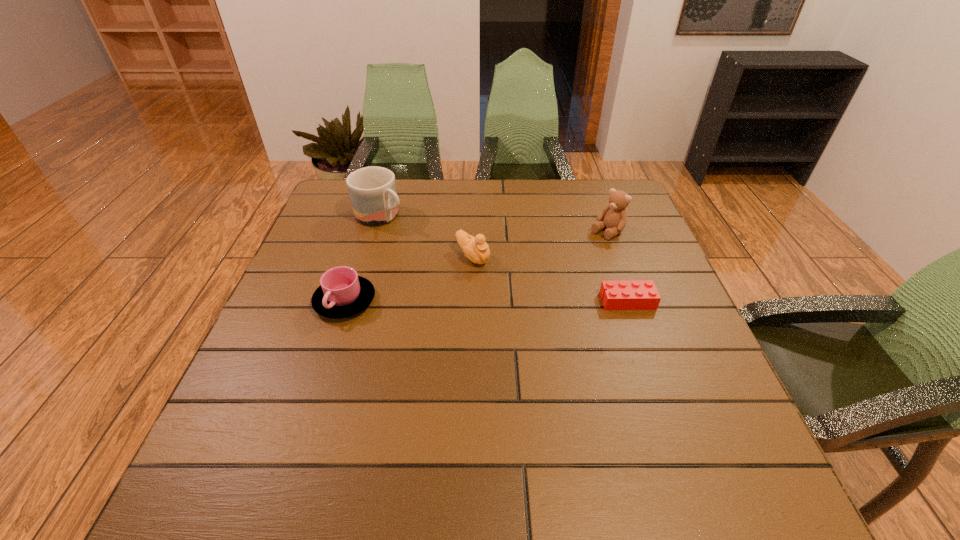
This screenshot has width=960, height=540. What are the coordinates of `Lego that is at the right edge` in the screenshot? It's located at (623, 294).

The width and height of the screenshot is (960, 540). Find the location of `teddy bear that is at the right edge`. teddy bear that is at the right edge is located at coordinates (614, 216).

At what (x,y) coordinates should I click in order to perform the action: click on object situated at the far left corner. Please return your answer as a coordinate pair (x, y). Image resolution: width=960 pixels, height=540 pixels. Looking at the image, I should click on (372, 190).

At what (x,y) coordinates should I click in order to perform the action: click on vacant space at the far edge of the desktop. Please return your answer as a coordinate pair (x, y). The height and width of the screenshot is (540, 960). Looking at the image, I should click on (483, 206).

Locate an element on the screen. The height and width of the screenshot is (540, 960). vacant position at the left edge of the desktop is located at coordinates (274, 373).

At what (x,y) coordinates should I click in order to perform the action: click on vacant area at the right edge of the desktop. Please return your answer as a coordinate pair (x, y). Looking at the image, I should click on (692, 372).

Where is `free space at the near right corner of the desktop`? free space at the near right corner of the desktop is located at coordinates (685, 429).

Identify the location of vacant area that lies between the cup and the Lego. (486, 301).

This screenshot has width=960, height=540. I want to click on free space between the mug and the fourth tallest object, so click(363, 259).

Identify the location of free spot between the mug and the Lego. The image size is (960, 540). (504, 258).